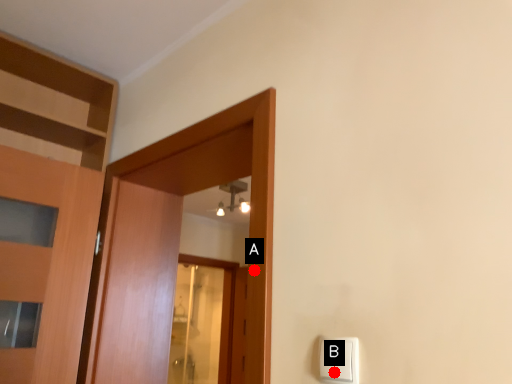
Question: Two points are circled on the image, labeled by A and B beside each circle. Which point is further to the camera?

Choices:
 (A) A is further
 (B) B is further

Answer: (A)